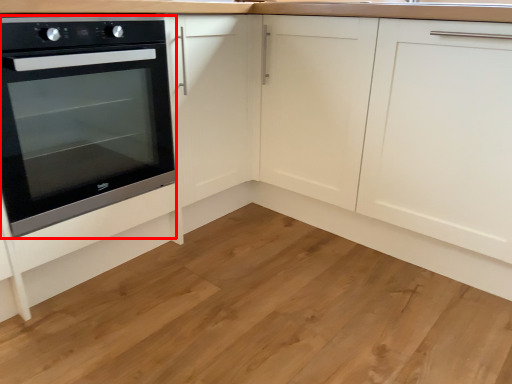
Question: Observing the image, what is the correct spatial positioning of oven (annotated by the red box) in reference to hardwood?

Choices:
 (A) left
 (B) right

Answer: (A)